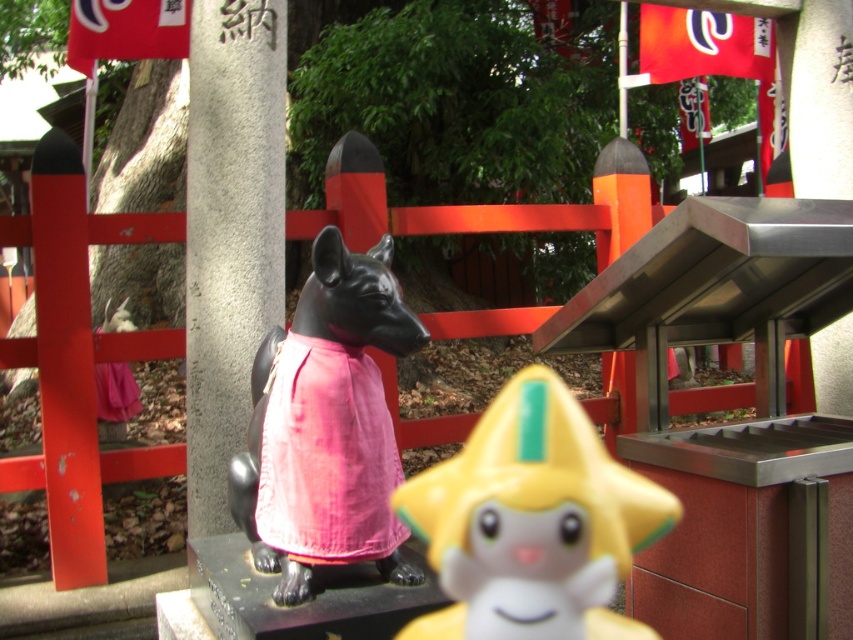
You are a visitor at the shrine and want to place a new offering. The yellow plastic star at center is shorter than the gray stone pillar at center. Can you place the star on top of the pillar?

The yellow plastic star at center is shorter than the gray stone pillar at center, so it can be placed on top of the pillar without stability issues.

You are taking a photo of the shrine scene. You notice two points in the image at coordinates point (398, 472) and point (367, 456). Which point is closer to the camera?

Point (367, 456) is closer to the camera because it is less further than point (398, 472).

You are standing in a traditional Japanese shrine and see two points marked in the scene. The first point is at coordinate point (521, 508) and the second is at point (192, 496). Which point is closer to you?

Point (192, 496) is closer to you because it is in front of point (521, 508).